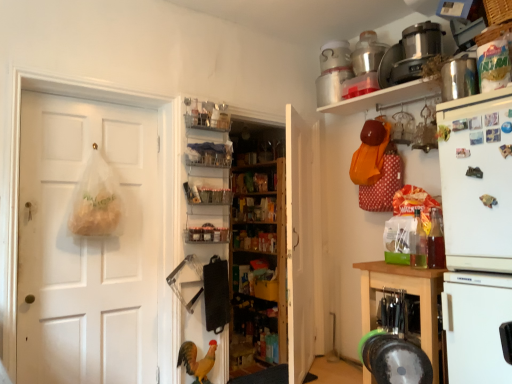
At what (x,y) coordinates should I click in order to perform the action: click on free space above clear plastic container at center, the 2th shelf ordered from the bottom (from a real-world perspective). Please return your answer as a coordinate pair (x, y). Looking at the image, I should click on (208, 180).